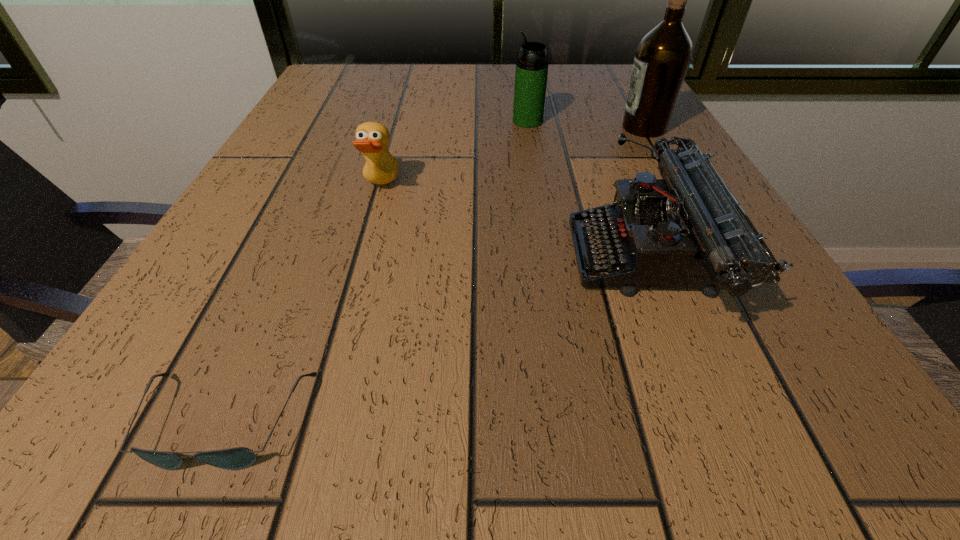
You are a GUI agent. You are given a task and a screenshot of the screen. Output one action in this format:
    pyautogui.click(x=<x>, y=<y>)
    Task: Click on the tallest object
    The height and width of the screenshot is (540, 960).
    Given the screenshot: What is the action you would take?
    pyautogui.click(x=663, y=56)

This screenshot has height=540, width=960. I want to click on thermos bottle, so click(x=531, y=73).

Where is `typewriter`? Image resolution: width=960 pixels, height=540 pixels. typewriter is located at coordinates (684, 231).

Where is `duck`? duck is located at coordinates (372, 138).

This screenshot has width=960, height=540. In order to click on sunglasses in this screenshot , I will do `click(237, 458)`.

Identify the location of the nearest object. The image size is (960, 540). (237, 458).

Where is `free point located on the label of the tallest object`? This screenshot has height=540, width=960. free point located on the label of the tallest object is located at coordinates (519, 128).

Where is `vacant region located on the label of the tallest object`? vacant region located on the label of the tallest object is located at coordinates (530, 128).

I want to click on vacant area situated on the label of the tallest object, so click(x=475, y=128).

This screenshot has height=540, width=960. What are the coordinates of `vacant space positioned from the spout of the fourth shortest object` in the screenshot? It's located at (351, 121).